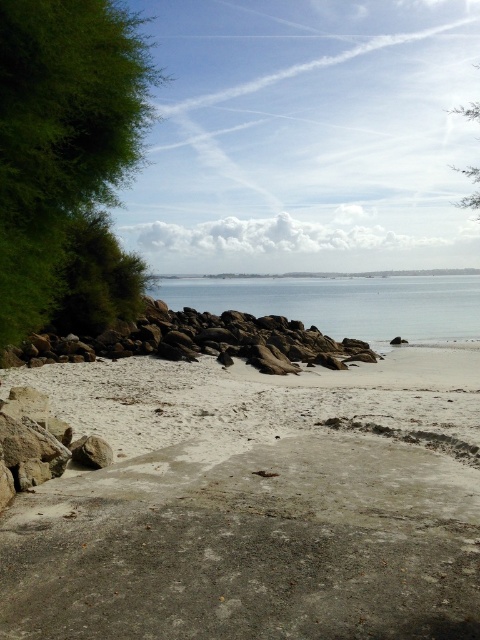
Question: Which of these objects is positioned farthest from the green leafy bush at left?

Choices:
 (A) green leafy tree at upper right
 (B) rockysmoothrocks at center

Answer: (A)

Question: Which point is closer to the camera taking this photo?

Choices:
 (A) (380, 330)
 (B) (163, 324)

Answer: (B)

Question: Can you confirm if clear blue water at center is thinner than rockysmoothrocks at center?

Choices:
 (A) no
 (B) yes

Answer: (A)

Question: Does gray concrete beach at lower left come in front of clear blue water at center?

Choices:
 (A) no
 (B) yes

Answer: (B)

Question: Which of the following is the farthest from the observer?

Choices:
 (A) (123, 316)
 (B) (207, 445)
 (C) (147, 120)
 (D) (243, 310)

Answer: (D)

Question: In this image, where is green leafy tree at left located relative to clear blue water at center?

Choices:
 (A) left
 (B) right

Answer: (A)